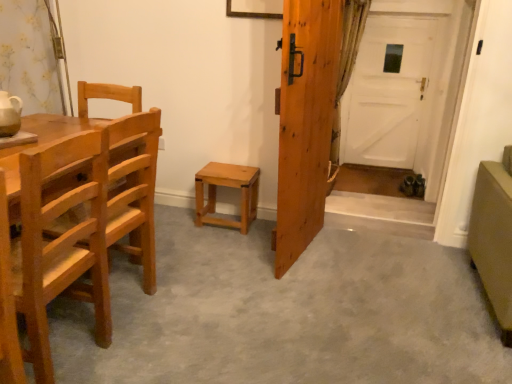
Question: In the image, is matte olive-green armchair at lower right on the left side or the right side of wooden door at center, the first door viewed from the front?

Choices:
 (A) right
 (B) left

Answer: (A)

Question: Is point click(x=501, y=183) positioned closer to the camera than point click(x=282, y=244)?

Choices:
 (A) closer
 (B) farther

Answer: (A)

Question: Based on their relative distances, which object is farther from the wooden door at center, the 2th door when ordered from back to front?

Choices:
 (A) light brown wood chair at left, which is counted as the 1th chair, starting from the back
 (B) matte olive-green armchair at lower right
 (C) white matte door at center, positioned as the second door in front-to-back order
 (D) light brown wood chair at left, the 1th chair in the front-to-back sequence
 (E) light brown wood stool at center

Answer: (C)

Question: Estimate the real-world distances between objects in this image. Which object is farther from the light brown wood chair at left, the second chair when ordered from back to front?

Choices:
 (A) light brown wood chair at left, which is counted as the 1th chair, starting from the back
 (B) green textured curtain at right
 (C) white matte door at center, the 1th door viewed from the right
 (D) light brown wood stool at center
 (E) matte olive-green armchair at lower right

Answer: (C)